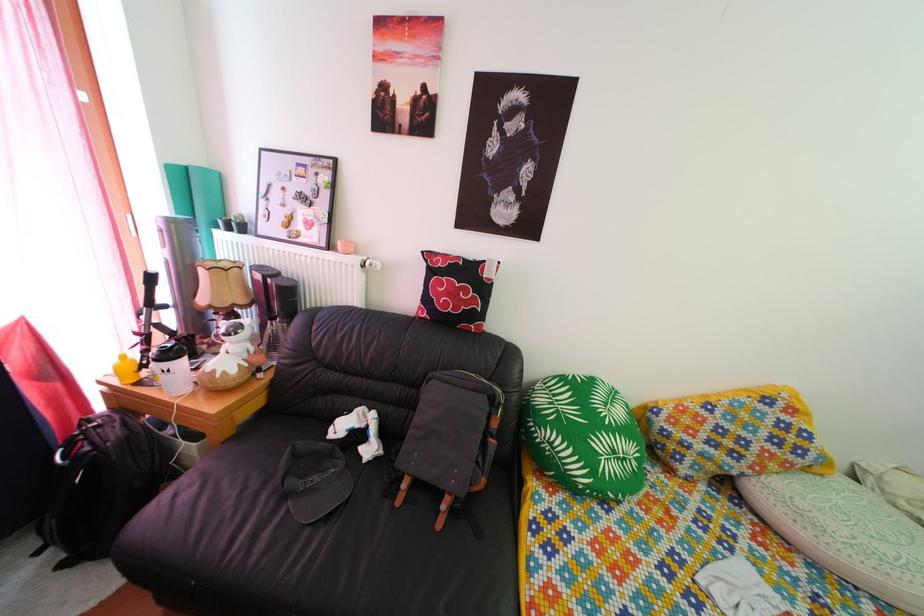
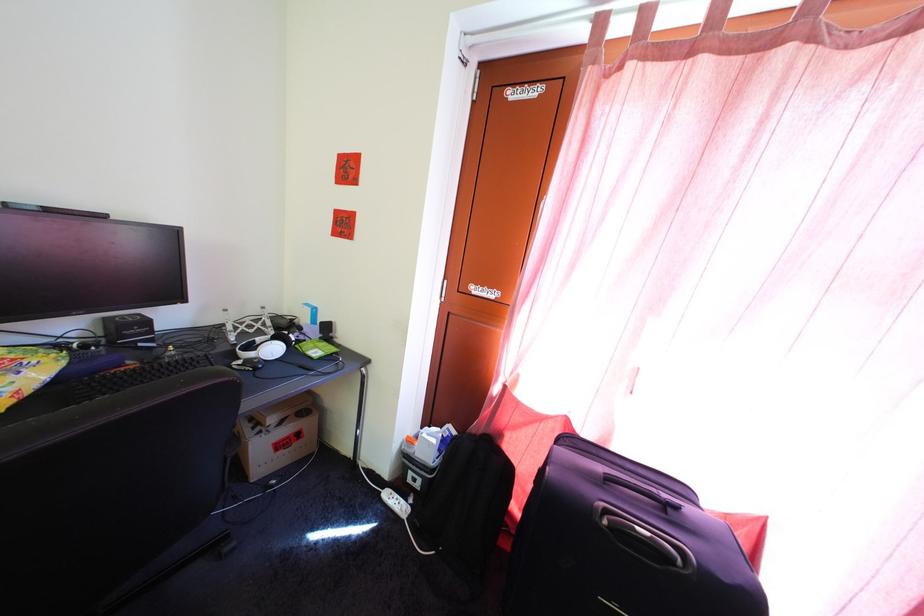
Question: The camera is either moving clockwise (left) or counter-clockwise (right) around the object. The first image is from the beginning of the video and the second image is from the end. Is the camera moving left or right when shooting the video?

Choices:
 (A) Left
 (B) Right

Answer: (B)